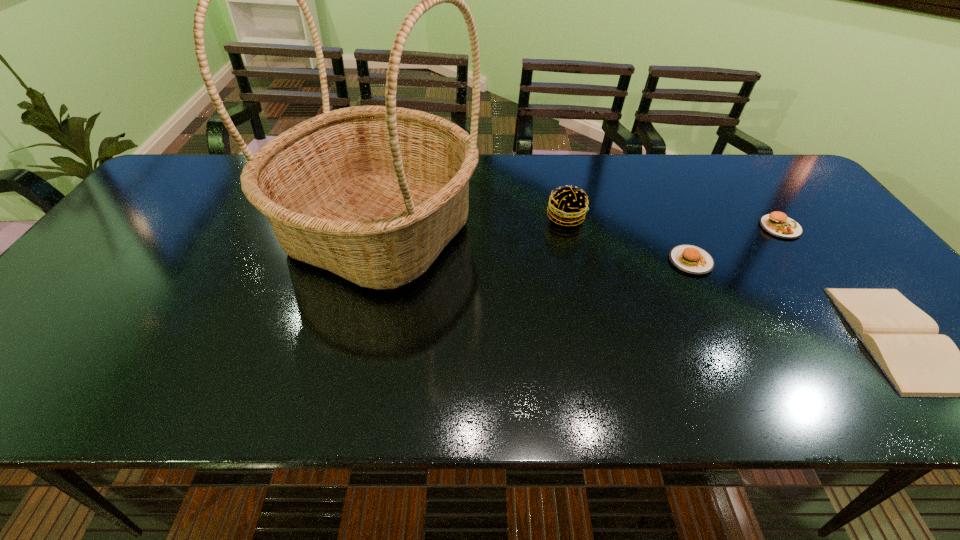
Image resolution: width=960 pixels, height=540 pixels. Find the location of `vacant space located on the back of the third object from left to right`. vacant space located on the back of the third object from left to right is located at coordinates (673, 225).

In order to click on object at the far edge in this screenshot , I will do `click(373, 194)`.

I want to click on object situated at the right edge, so click(778, 224).

At what (x,y) coordinates should I click in order to perform the action: click on vacant space at the far edge. Please return your answer as a coordinate pair (x, y). Looking at the image, I should click on point(646,172).

Find the location of `vacant space at the near edge of the desktop`. vacant space at the near edge of the desktop is located at coordinates (717, 392).

Where is `free region at the left edge`? This screenshot has height=540, width=960. free region at the left edge is located at coordinates tap(151, 217).

The image size is (960, 540). In order to click on vacant space at the right edge of the desktop in this screenshot , I will do `click(812, 257)`.

Where is `free region at the near left corner`? This screenshot has width=960, height=540. free region at the near left corner is located at coordinates (41, 369).

The image size is (960, 540). I want to click on blank region between the rightmost food and the third object from left to right, so click(x=735, y=244).

Identify the location of free space between the rightmost food and the tallest object. (580, 229).